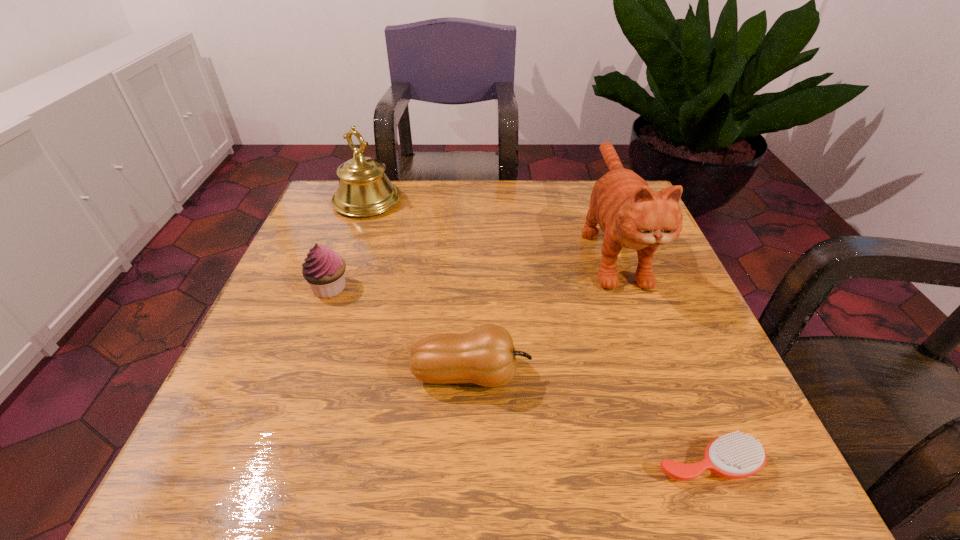
Find the location of a particular element. Image resolution: width=960 pixels, height=540 pixels. cat is located at coordinates (631, 215).

The width and height of the screenshot is (960, 540). What are the coordinates of `the second tallest object` in the screenshot? It's located at (364, 190).

In order to click on cupcake in this screenshot , I will do `click(323, 269)`.

In order to click on the second nearest object in this screenshot , I will do click(486, 356).

At what (x,y) coordinates should I click in order to perform the action: click on gourd. Please return your answer as a coordinate pair (x, y). Looking at the image, I should click on (486, 356).

The height and width of the screenshot is (540, 960). Identify the location of the shortest object. (735, 455).

Where is `the nearest object`? This screenshot has width=960, height=540. the nearest object is located at coordinates (735, 455).

Where is `blank space located on the face of the cat`? Image resolution: width=960 pixels, height=540 pixels. blank space located on the face of the cat is located at coordinates (670, 407).

Locate an element on the screen. Image resolution: width=960 pixels, height=540 pixels. vacant space located on the front of the bell is located at coordinates pos(327,315).

This screenshot has height=540, width=960. In order to click on vacant space located 0.260m on the back of the cupcake in this screenshot , I will do `click(360, 207)`.